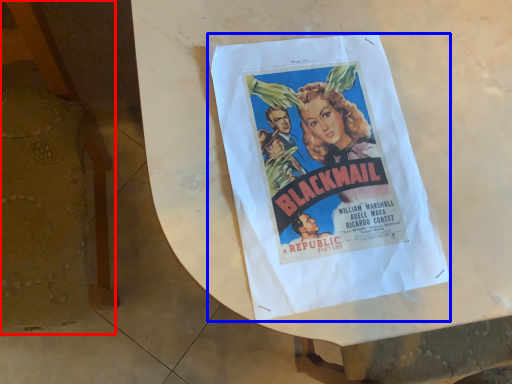
Question: Among these objects, which one is farthest to the camera, furniture (highlighted by a red box) or poster (highlighted by a blue box)?

Choices:
 (A) furniture
 (B) poster

Answer: (B)